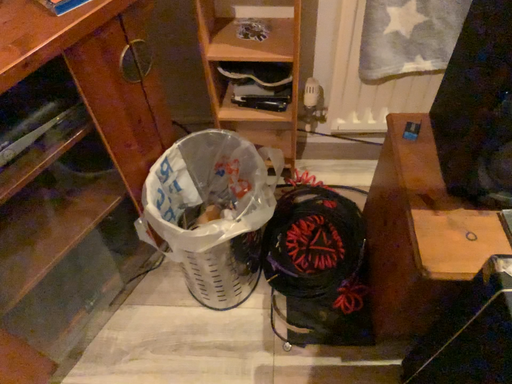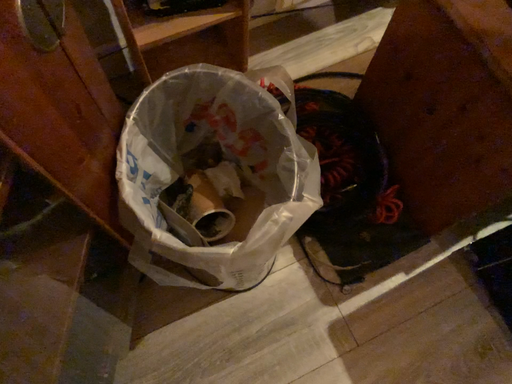
Question: How did the camera likely rotate when shooting the video?

Choices:
 (A) rotated downward
 (B) rotated upward

Answer: (A)